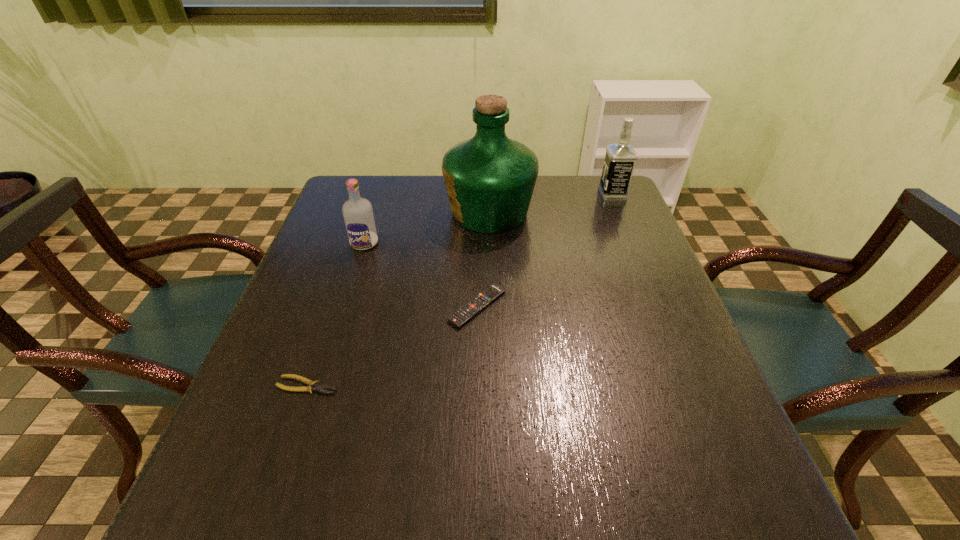
Where is `vacant space that satisfies the following two spatial constraints: 1. on the front label of the rightmost object; 2. on the label of the third shortest object`? The width and height of the screenshot is (960, 540). vacant space that satisfies the following two spatial constraints: 1. on the front label of the rightmost object; 2. on the label of the third shortest object is located at coordinates (634, 244).

I want to click on free point that satisfies the following two spatial constraints: 1. on the label side of the liquor; 2. on the label of the left vodka, so click(491, 244).

Identify the location of vacant area in the image that satisfies the following two spatial constraints: 1. on the label side of the tallest object; 2. on the label of the third tallest object. (491, 244).

This screenshot has width=960, height=540. Identify the location of vacant area in the image that satisfies the following two spatial constraints: 1. on the label side of the liquor; 2. on the front side of the nearest object. 494,385.

Where is `vacant space that satisfies the following two spatial constraints: 1. on the front label of the fourth shortest object; 2. on the front side of the shortest object`? vacant space that satisfies the following two spatial constraints: 1. on the front label of the fourth shortest object; 2. on the front side of the shortest object is located at coordinates (693, 385).